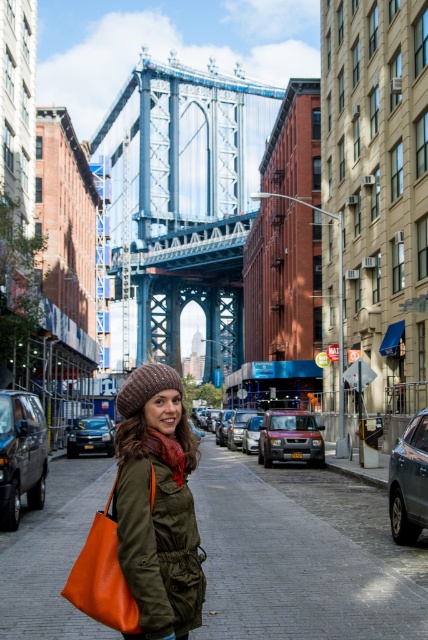
You are a delivery person trying to place a package in the orange leather tote at lower left and the matte red suv at center. Which container has a smaller width, requiring you to choose the right size box?

The orange leather tote at lower left has a lesser width compared to the matte red suv at center, so you should choose a smaller box for the orange leather tote at lower left.

You are a delivery driver who needs to park your vehicle between the shiny silver car at right and the matte silver suv at center. Your delivery van is 20 feet long. Is there enough space between them for your van?

The shiny silver car at right is 47.24 feet from the matte silver suv at center. Since your van is 20 feet long, there is sufficient space between them to park your van.

You are a delivery person trying to place an orange leather tote at lower left onto the matte red suv at center. Can you place the tote on the suv without removing the existing items on the suv?

The orange leather tote at lower left is positioned over matte red suv at center, which means it is already placed on the suv. Therefore, you don not need to move it.